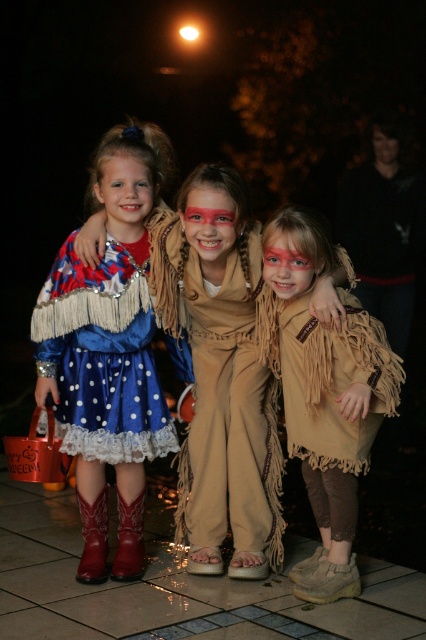
You are standing at the point labeled point (388, 138) and want to walk to the point labeled point (386, 392). Which direction should you move to reach your destination?

You should move forward to reach point (386, 392) because it is in front of point (388, 138).

You are standing in the residential area where the three girls are. The tan suede jumpsuit at center is located at point (221, 396). If you want to walk towards the tan suede jumpsuit at center from the left side of the image, which direction should you move?

To reach the tan suede jumpsuit at center from the left side of the image, you should move towards the right since the tan suede jumpsuit at center is located at point (221, 396), which is to the right of the left side.